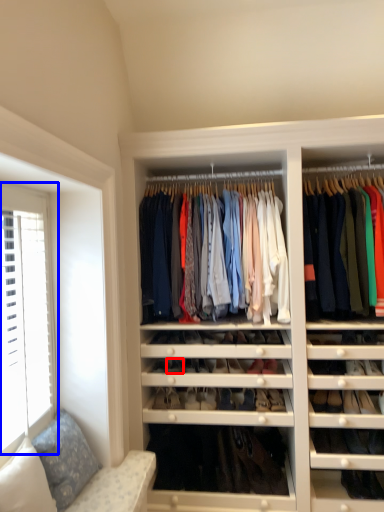
Question: Which point is closer to the camera, shoe (highlighted by a red box) or window (highlighted by a blue box)?

Choices:
 (A) shoe
 (B) window

Answer: (B)